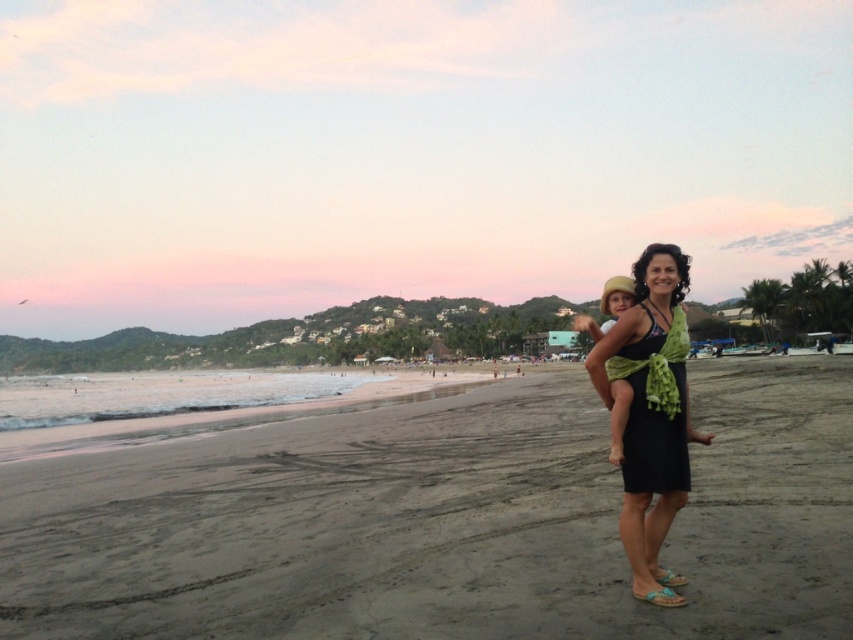
Question: Among these objects, which one is farthest from the camera?

Choices:
 (A) black satin dress at center
 (B) black fabric dress at center
 (C) dark brown sand at center

Answer: (B)

Question: Which of the following is the farthest from the observer?

Choices:
 (A) dark brown sand at center
 (B) black fabric dress at center
 (C) black satin dress at center

Answer: (B)

Question: Can you confirm if dark brown sand at center is positioned to the right of black satin dress at center?

Choices:
 (A) no
 (B) yes

Answer: (B)

Question: Does black fabric dress at center appear on the left side of black satin dress at center?

Choices:
 (A) yes
 (B) no

Answer: (B)

Question: Among these objects, which one is farthest from the camera?

Choices:
 (A) dark brown sand at center
 (B) black satin dress at center

Answer: (B)

Question: Observing the image, what is the correct spatial positioning of dark brown sand at center in reference to black satin dress at center?

Choices:
 (A) right
 (B) left

Answer: (A)